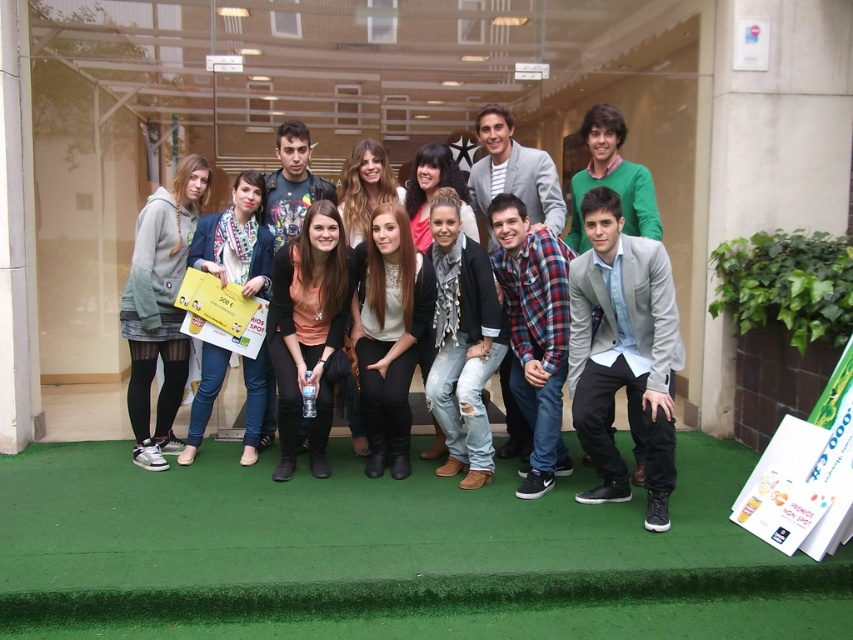
Question: Estimate the real-world distances between objects in this image. Which object is closer to the denim jacket at center?

Choices:
 (A) matte black jacket at center
 (B) matte gray hoodie at left
 (C) ripped denim jeans at center
 (D) white matte shirt at center

Answer: (B)

Question: Is matte gray hoodie at left to the left of white matte shirt at center from the viewer's perspective?

Choices:
 (A) yes
 (B) no

Answer: (A)

Question: Is matte black jacket at center positioned behind ripped denim jeans at center?

Choices:
 (A) no
 (B) yes

Answer: (B)

Question: Considering the relative positions of matte black jacket at center and white matte shirt at center in the image provided, where is matte black jacket at center located with respect to white matte shirt at center?

Choices:
 (A) right
 (B) left

Answer: (B)

Question: Among these points, which one is nearest to the camera?

Choices:
 (A) (260, 403)
 (B) (398, 474)
 (C) (148, 394)
 (D) (340, 310)

Answer: (B)

Question: Which of the following is the closest to the observer?

Choices:
 (A) (404, 300)
 (B) (456, 365)

Answer: (A)